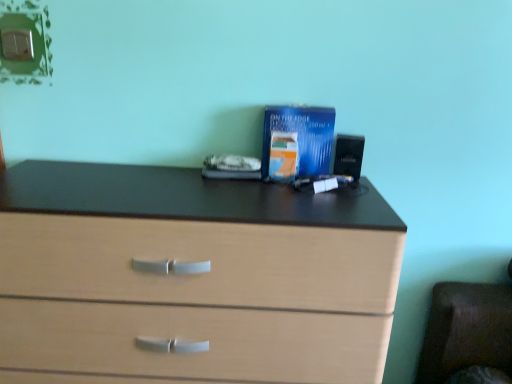
Question: Considering the positions of blue glossy paperback book at center, the first paperback book positioned from the back, and blue glossy paperback book at center, which is the 2th paperback book from back to front, in the image, is blue glossy paperback book at center, the first paperback book positioned from the back, bigger or smaller than blue glossy paperback book at center, which is the 2th paperback book from back to front,?

Choices:
 (A) big
 (B) small

Answer: (A)

Question: From the image's perspective, is blue glossy paperback book at center, the first paperback book positioned from the back, positioned above or below blue glossy paperback book at center, which is the 2th paperback book from back to front?

Choices:
 (A) below
 (B) above

Answer: (B)

Question: Based on their relative distances, which object is farther from the blue glossy paperback book at center, the first paperback book positioned from the back?

Choices:
 (A) blue glossy paperback book at center, which is the 2th paperback book from back to front
 (B) light wood chest of drawers at center

Answer: (B)

Question: Which object is the closest to the blue glossy paperback book at center, the first paperback book positioned from the back?

Choices:
 (A) light wood chest of drawers at center
 (B) blue glossy paperback book at center, the first paperback book positioned from the front

Answer: (B)